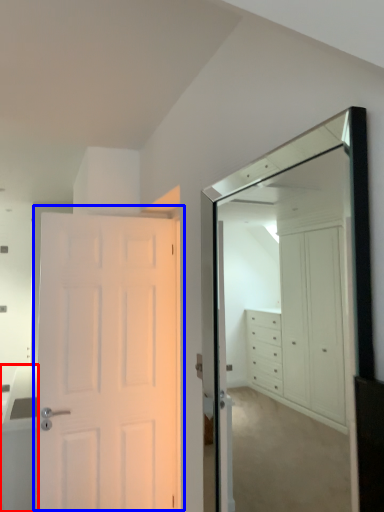
Question: Which object is further to the camera taking this photo, cabinetry (highlighted by a red box) or door (highlighted by a blue box)?

Choices:
 (A) cabinetry
 (B) door

Answer: (A)